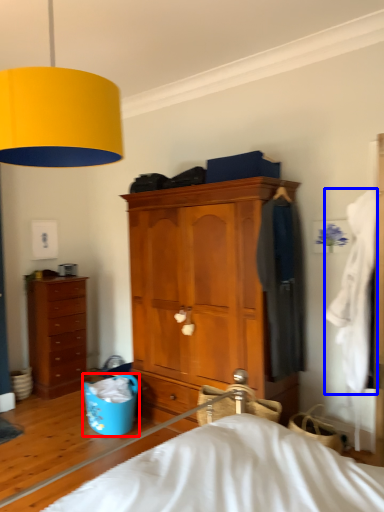
Question: Which object is closer to the camera taking this photo, laundry basket (highlighted by a red box) or clothing (highlighted by a blue box)?

Choices:
 (A) laundry basket
 (B) clothing

Answer: (B)